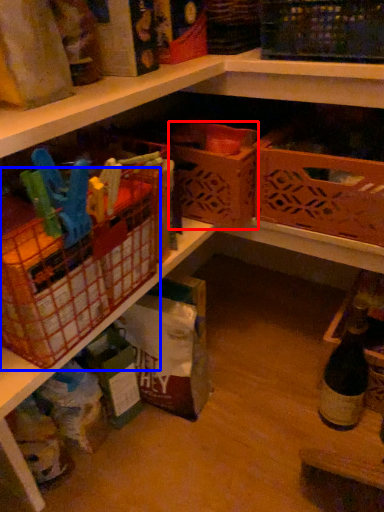
Question: Which object is further to the camera taking this photo, basket (highlighted by a red box) or basket (highlighted by a blue box)?

Choices:
 (A) basket
 (B) basket

Answer: (A)